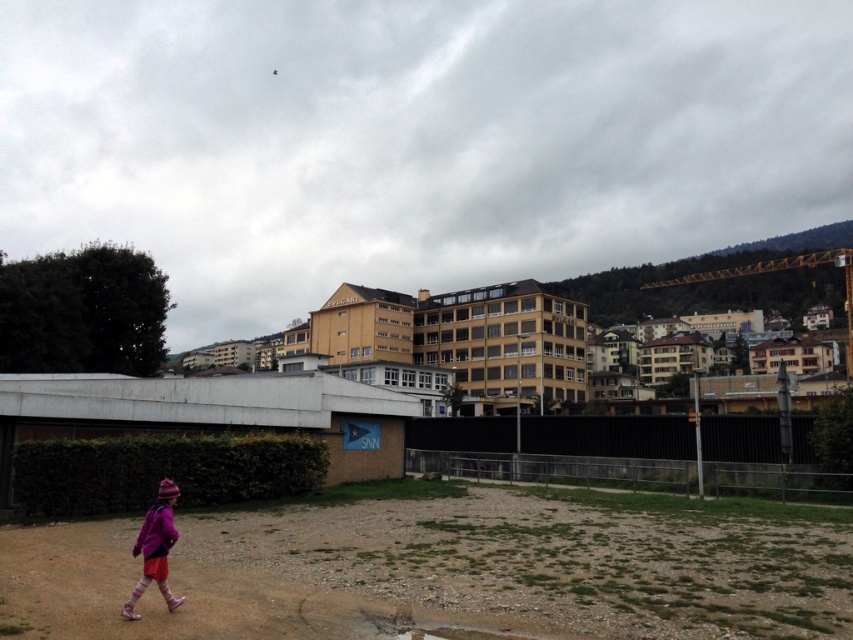
You are a delivery person who needs to cross the brown gravel field at lower left to reach the delivery point. However, there is a white concrete overpass at center above it. Is the gravel field accessible for you to walk on?

The brown gravel field at lower left is located below the white concrete overpass at center, so it is accessible for you to walk on.

Based on the photo, you are standing at the lower left corner of the image. You see the brown gravel field at lower left and the pink woolen hat at lower left. Which object is wider from your perspective?

The brown gravel field at lower left might be wider than pink woolen hat at lower left, so the brown gravel field at lower left is possibly wider.

You are navigating an urban area and need to reach a destination located at point (360, 397). You are currently at point (164, 481). Based on the scene description, which direction should you move to reach your destination?

To reach point (360, 397) from point (164, 481), you should move upwards because point (360, 397) is behind point (164, 481) in the scene.